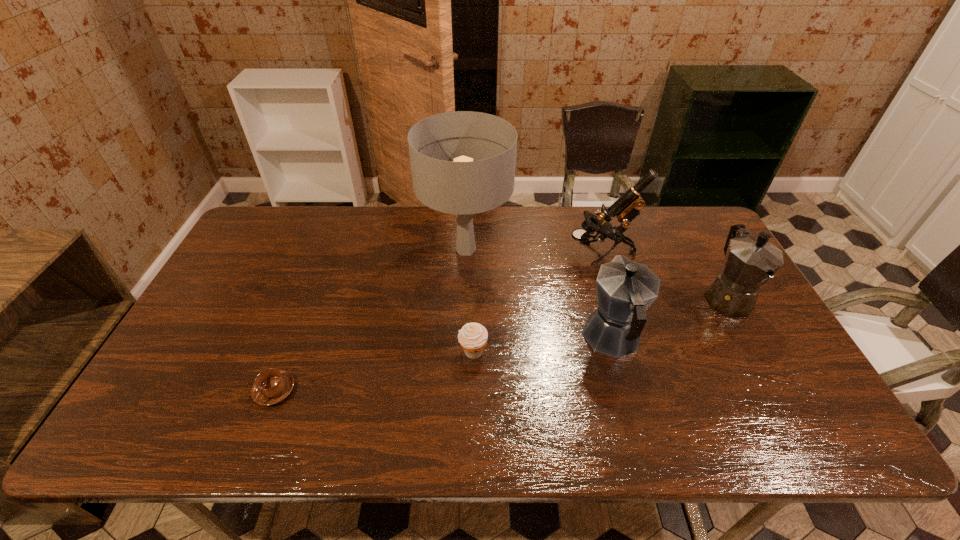
The height and width of the screenshot is (540, 960). What are the coordinates of `blank area at the far edge` in the screenshot? It's located at (516, 211).

In the image, there is a desktop. At what (x,y) coordinates should I click in order to perform the action: click on vacant space at the near edge. Please return your answer as a coordinate pair (x, y). Looking at the image, I should click on (388, 413).

In the image, there is a desktop. Where is `vacant space at the left edge`? Image resolution: width=960 pixels, height=540 pixels. vacant space at the left edge is located at coordinates (206, 298).

Locate an element on the screen. The image size is (960, 540). vacant space at the near right corner is located at coordinates (780, 427).

At what (x,y) coordinates should I click in order to perform the action: click on empty space that is in between the left coffeepot and the fifth tallest object. Please return your answer as a coordinate pair (x, y). Image resolution: width=960 pixels, height=540 pixels. Looking at the image, I should click on (542, 345).

You are a GUI agent. You are given a task and a screenshot of the screen. Output one action in this format:
    pyautogui.click(x=<x>, y=<y>)
    Task: Click on the empty space between the nearest object and the left coffeepot
    
    Given the screenshot: What is the action you would take?
    pyautogui.click(x=444, y=364)

The image size is (960, 540). What are the coordinates of `free spot between the tallest object and the microscope` in the screenshot? It's located at (534, 251).

What are the coordinates of `vacant area that lies between the muffin and the cappuccino` in the screenshot? It's located at (373, 371).

The height and width of the screenshot is (540, 960). I want to click on free space between the nearest object and the second shortest object, so click(x=373, y=371).

Find the location of a particular element. empty space that is in between the muffin and the microscope is located at coordinates (538, 302).